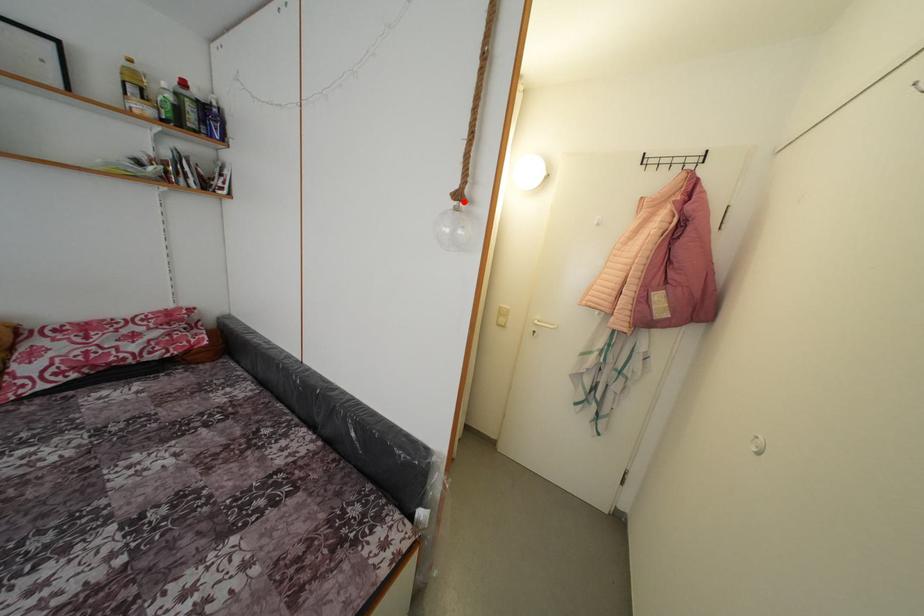
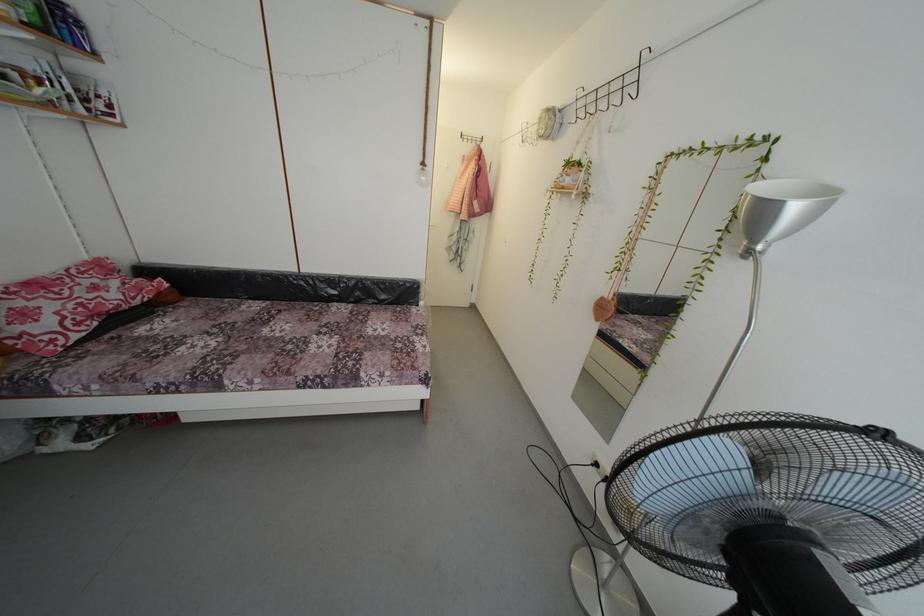
Question: I am providing you with two images of the same scene from different viewpoints. A red point is marked on the first image. Is the red point's position out of view in image 2?

Choices:
 (A) Yes
 (B) No

Answer: (B)